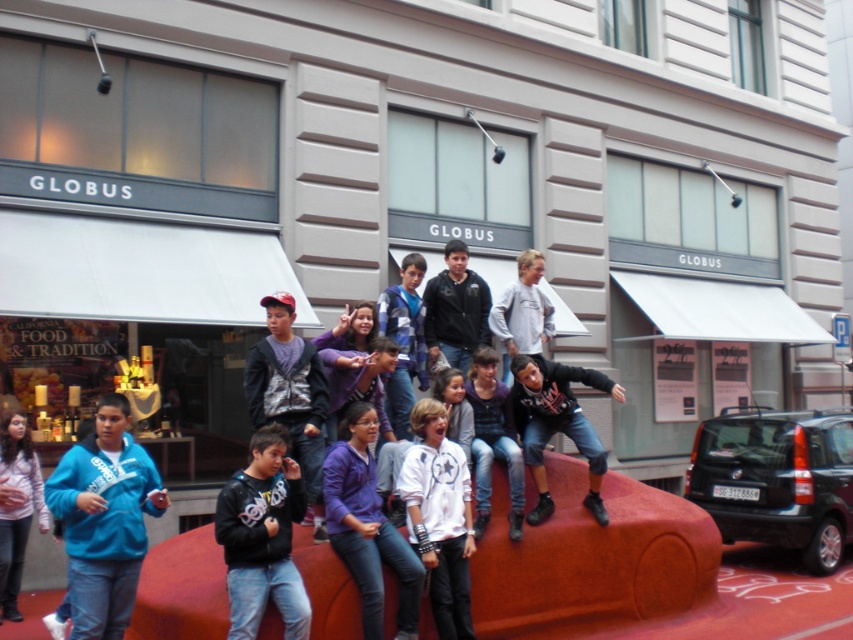
Question: Which point is closer to the camera taking this photo?

Choices:
 (A) (595, 445)
 (B) (292, 344)
 (C) (445, 326)
 (D) (280, 497)

Answer: (D)

Question: Which point appears farthest from the camera in this image?

Choices:
 (A) (438, 308)
 (B) (0, 458)

Answer: (A)

Question: Among these objects, which one is nearest to the camera?

Choices:
 (A) black matte hoodie at center
 (B) dark blue jacket at center
 (C) white matte shirt at center

Answer: (C)

Question: Is white matte shirt at center closer to the viewer compared to dark blue jacket at center?

Choices:
 (A) no
 (B) yes

Answer: (B)

Question: Does dark gray hoodie at center appear over dark blue jacket at center?

Choices:
 (A) yes
 (B) no

Answer: (B)

Question: Is black leather jacket at center positioned at the back of dark blue jacket at center?

Choices:
 (A) yes
 (B) no

Answer: (B)